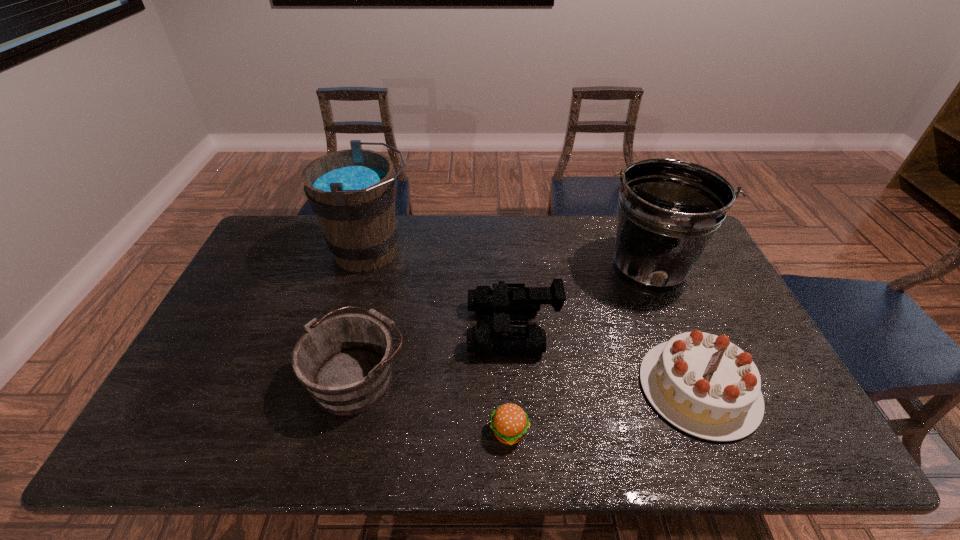
Where is `the taller wine bucket`? Image resolution: width=960 pixels, height=540 pixels. the taller wine bucket is located at coordinates (352, 192).

The image size is (960, 540). What are the coordinates of `bucket` in the screenshot? It's located at (669, 209).

The image size is (960, 540). In order to click on binoculars in this screenshot , I will do `click(499, 302)`.

The image size is (960, 540). In order to click on the nearer wine bucket in this screenshot , I will do [345, 361].

Where is `birthday cake`? The height and width of the screenshot is (540, 960). birthday cake is located at coordinates (703, 384).

At what (x,y) coordinates should I click in order to perform the action: click on hamburger. Please return your answer as a coordinate pair (x, y). The image size is (960, 540). Looking at the image, I should click on (509, 422).

Identify the location of free space located with a handle on the side of the taller wine bucket. (437, 252).

Identify the location of free spot located 0.110m on the front of the bucket. (673, 330).

At what (x,y) coordinates should I click in order to perform the action: click on vacant position located on the front lenses of the binoculars. Please return your answer as a coordinate pair (x, y). This screenshot has height=540, width=960. Looking at the image, I should click on (372, 329).

Find the location of a particular element. The image size is (960, 540). free space located 0.350m on the front lenses of the binoculars is located at coordinates (345, 329).